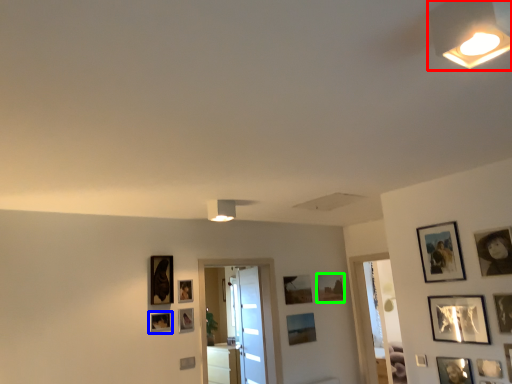
Question: Which object is the closest to the light fixture (highlighted by a red box)? Choose among these: picture frame (highlighted by a blue box) or picture frame (highlighted by a green box).

Choices:
 (A) picture frame
 (B) picture frame

Answer: (A)